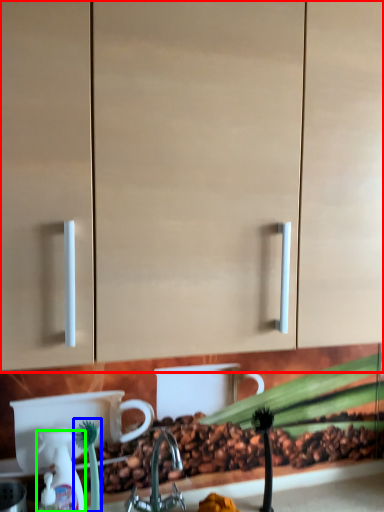
Question: Which is nearer to the cabinetry (highlighted by a red box)? plant (highlighted by a blue box) or soap dispenser (highlighted by a green box).

Choices:
 (A) plant
 (B) soap dispenser

Answer: (A)